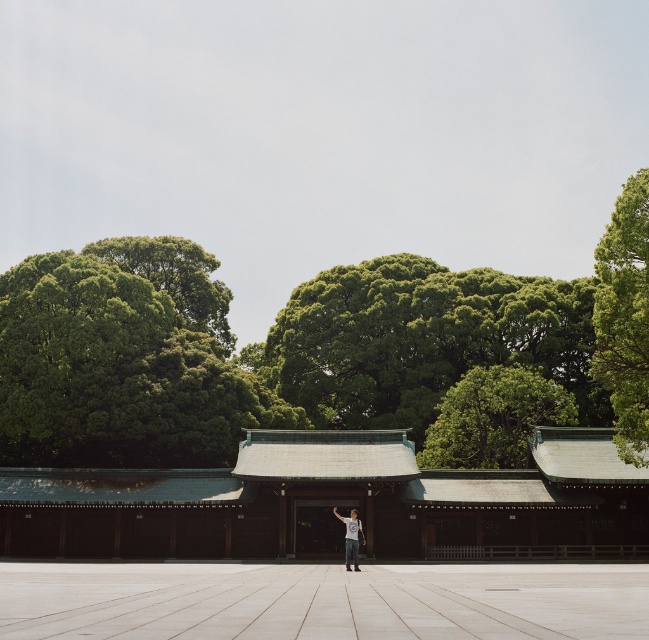
You are a photographer planning to take a picture of the green leafy tree at center and the white cotton shirt at center. Which object will appear larger in the photo?

The green leafy tree at center will appear larger in the photo because it is bigger than the white cotton shirt at center.